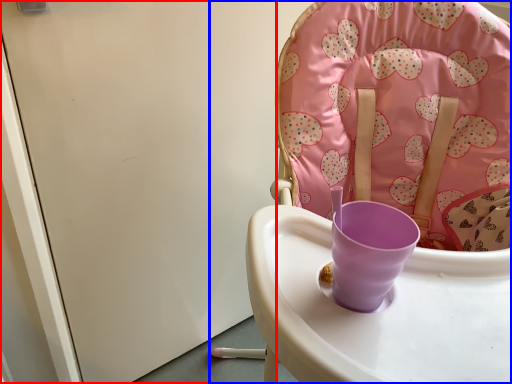
Question: Which object appears farthest to the camera in this image, screen door (highlighted by a red box) or chair (highlighted by a blue box)?

Choices:
 (A) screen door
 (B) chair

Answer: (A)